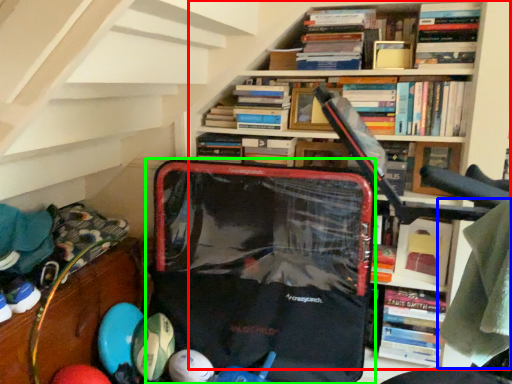
Question: Which object is positioned closest to bookcase (highlighted by a red box)? Select from clothing (highlighted by a blue box) and pack (highlighted by a green box).

Choices:
 (A) clothing
 (B) pack

Answer: (B)